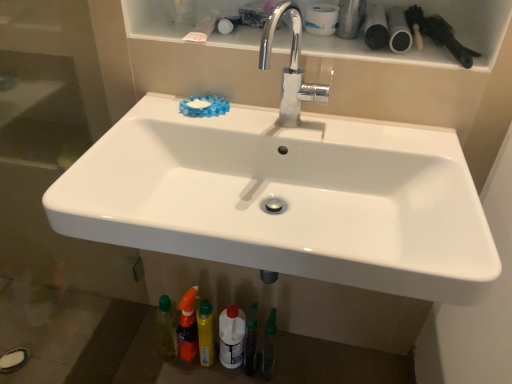
Question: Does black matte brush at upper right turn towards white matte toilet paper at upper center?

Choices:
 (A) yes
 (B) no

Answer: (B)

Question: Is black matte brush at upper right in contact with white matte toilet paper at upper center?

Choices:
 (A) yes
 (B) no

Answer: (B)

Question: Is black matte brush at upper right to the left of white matte toilet paper at upper center from the viewer's perspective?

Choices:
 (A) no
 (B) yes

Answer: (A)

Question: From a real-world perspective, is black matte brush at upper right below white matte toilet paper at upper center?

Choices:
 (A) no
 (B) yes

Answer: (B)

Question: Would you say black matte brush at upper right contains white matte toilet paper at upper center?

Choices:
 (A) no
 (B) yes

Answer: (A)

Question: Can you confirm if black matte brush at upper right is smaller than white matte toilet paper at upper center?

Choices:
 (A) no
 (B) yes

Answer: (A)

Question: Is white matte toilet paper at upper center smaller than white glossy shelf at upper center?

Choices:
 (A) yes
 (B) no

Answer: (A)

Question: Is white matte toilet paper at upper center not inside white glossy shelf at upper center?

Choices:
 (A) no
 (B) yes

Answer: (B)

Question: Does white matte toilet paper at upper center appear on the right side of white glossy shelf at upper center?

Choices:
 (A) yes
 (B) no

Answer: (A)

Question: From the image's perspective, would you say white matte toilet paper at upper center is shown under white glossy shelf at upper center?

Choices:
 (A) no
 (B) yes

Answer: (A)

Question: Is white matte toilet paper at upper center next to white glossy shelf at upper center and touching it?

Choices:
 (A) yes
 (B) no

Answer: (B)

Question: Can you confirm if white matte toilet paper at upper center is thinner than white glossy shelf at upper center?

Choices:
 (A) no
 (B) yes

Answer: (B)

Question: Is chrome metallic faucet at upper center at the back of translucent orange spray bottle at lower center, the second toiletry positioned from the right?

Choices:
 (A) no
 (B) yes

Answer: (A)